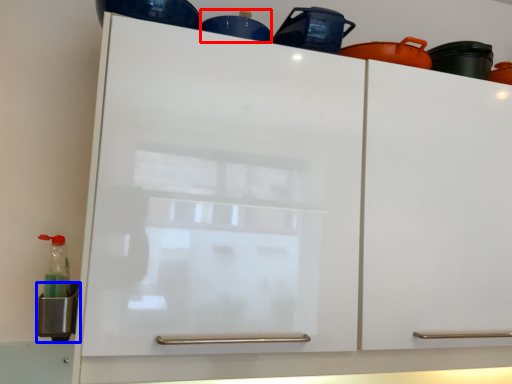
Question: Which of the following is the closest to the observer, appliance (highlighted by a red box) or appliance (highlighted by a blue box)?

Choices:
 (A) appliance
 (B) appliance

Answer: (B)